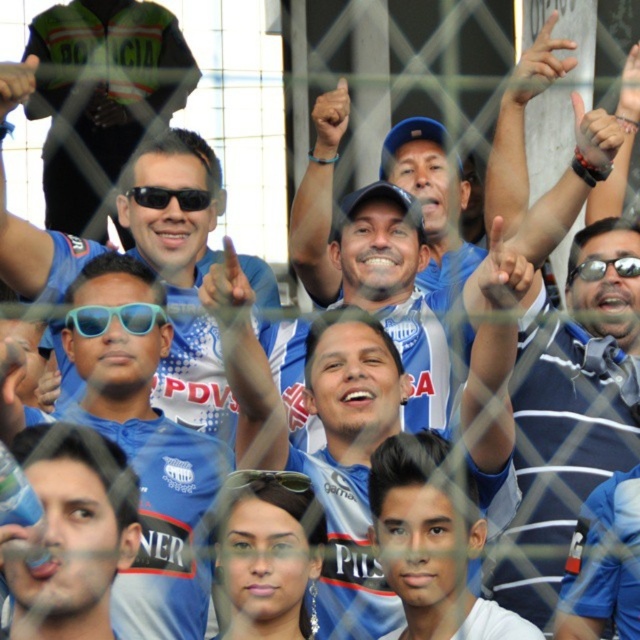
Does blue fabric shirt at center have a greater height compared to teal plastic sunglasses at center?

Indeed, blue fabric shirt at center has a greater height compared to teal plastic sunglasses at center.

Is blue fabric shirt at center shorter than teal plastic sunglasses at center?

Incorrect, blue fabric shirt at center's height does not fall short of teal plastic sunglasses at center's.

Does point (44, 289) come closer to viewer compared to point (99, 314)?

No, it is behind (99, 314).

The image size is (640, 640). I want to click on blue fabric shirt at center, so click(x=195, y=380).

Does blue fabric shirt at center lie behind green matte sunglasses at center?

Yes, blue fabric shirt at center is further from the viewer.

Is blue fabric shirt at center thinner than green matte sunglasses at center?

No, blue fabric shirt at center is not thinner than green matte sunglasses at center.

Identify the location of blue fabric shirt at center. This screenshot has width=640, height=640. (195, 380).

Is point (93, 316) farther from camera compared to point (600, 259)?

No, it is not.

The width and height of the screenshot is (640, 640). What do you see at coordinates (115, 316) in the screenshot?
I see `teal plastic sunglasses at center` at bounding box center [115, 316].

Find the location of a particular element. This screenshot has width=640, height=640. teal plastic sunglasses at center is located at coordinates (115, 316).